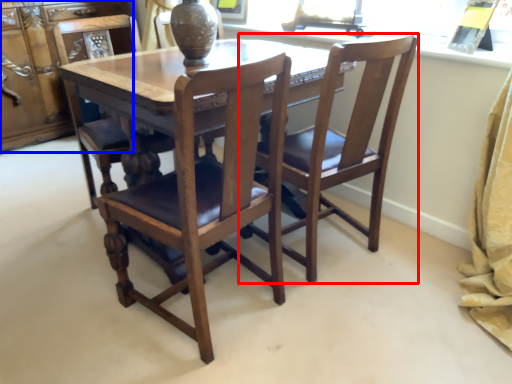
Question: Which object appears farthest to the camera in this image, chair (highlighted by a red box) or cabinetry (highlighted by a blue box)?

Choices:
 (A) chair
 (B) cabinetry

Answer: (B)